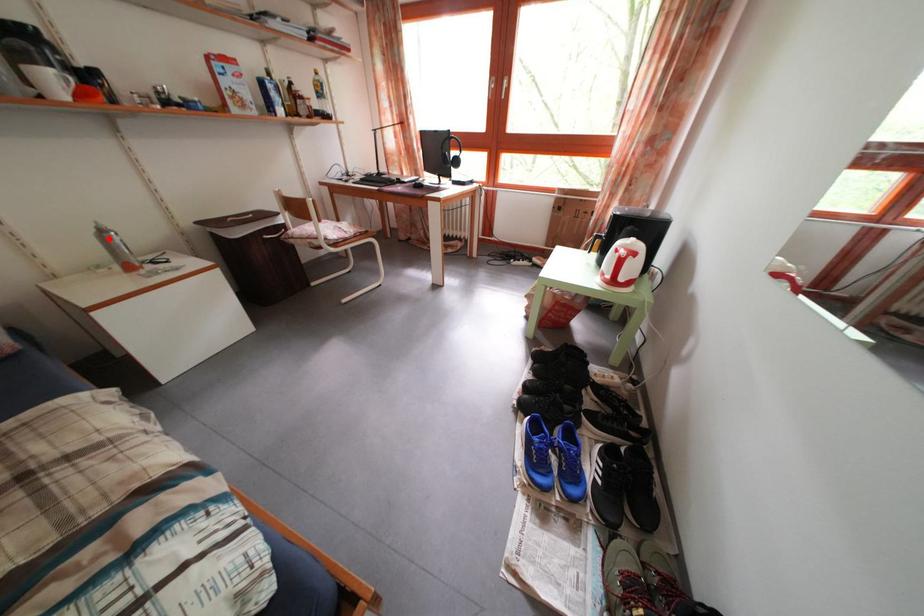
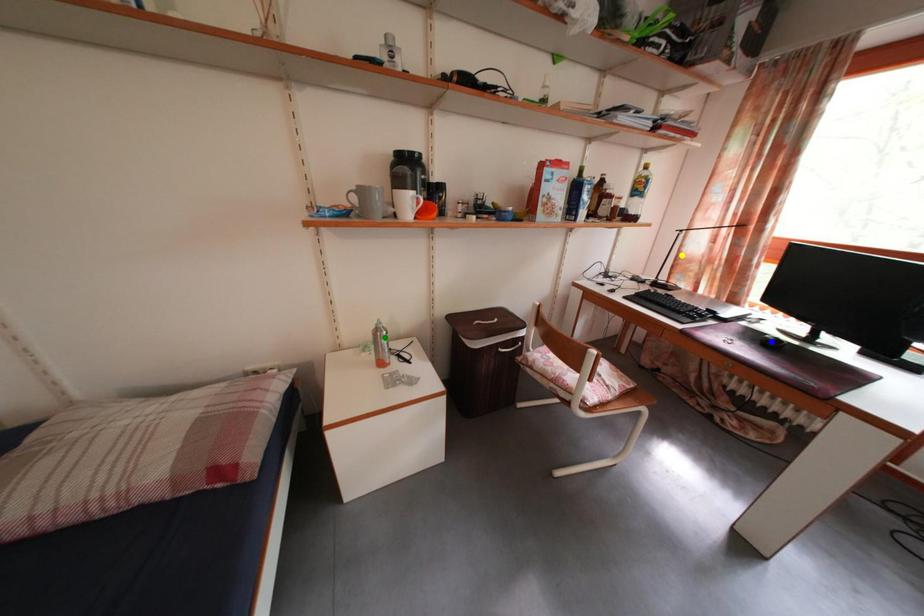
Question: I am providing you with two images of the same scene from different viewpoints. A red point is marked on the first image. You are given multiple points on the second image. Can you choose the point in image 2 that corresponds to the point in image 1?

Choices:
 (A) blue point
 (B) yellow point
 (C) green point

Answer: (C)